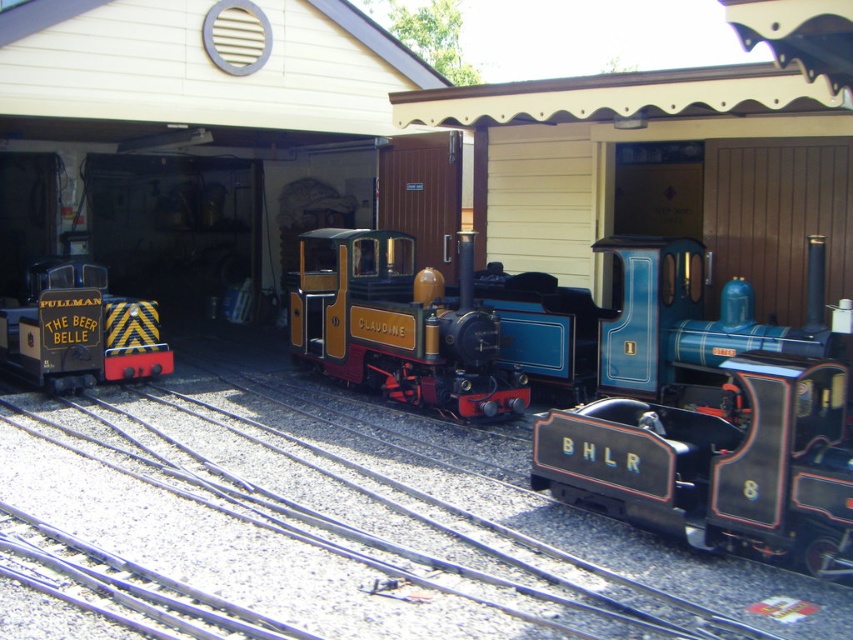
Question: Is the position of black polished wood train at center more distant than that of yellow and black striped train at left?

Choices:
 (A) no
 (B) yes

Answer: (A)

Question: Can you confirm if black polished wood train at center is bigger than gold polished metal claudine at center?

Choices:
 (A) no
 (B) yes

Answer: (A)

Question: Which point is farther from the camera taking this photo?

Choices:
 (A) (793, 401)
 (B) (91, 371)
 (C) (310, 292)

Answer: (C)

Question: Which object appears farthest from the camera in this image?

Choices:
 (A) black polished wood train at center
 (B) gold polished metal claudine at center

Answer: (B)

Question: Which object is positioned closest to the yellow and black striped train at left?

Choices:
 (A) black polished wood train at center
 (B) gold polished metal claudine at center

Answer: (B)

Question: Is gold polished metal claudine at center below yellow and black striped train at left?

Choices:
 (A) no
 (B) yes

Answer: (B)